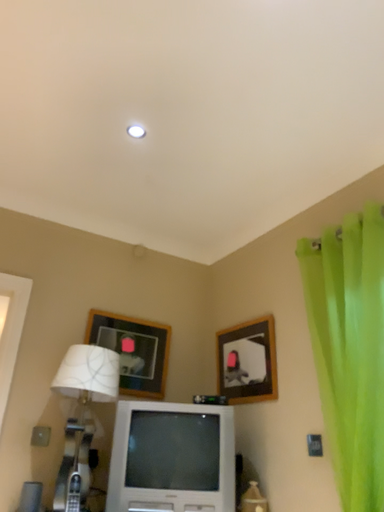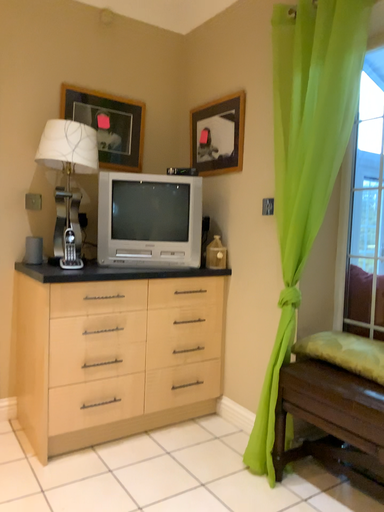
Question: How did the camera likely rotate when shooting the video?

Choices:
 (A) rotated downward
 (B) rotated upward

Answer: (A)